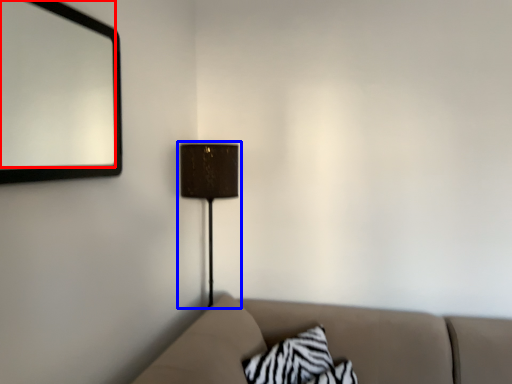
Question: Among these objects, which one is farthest to the camera, mirror (highlighted by a red box) or lamp (highlighted by a blue box)?

Choices:
 (A) mirror
 (B) lamp

Answer: (B)